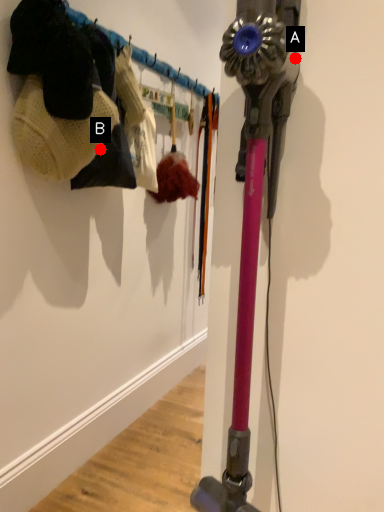
Question: Two points are circled on the image, labeled by A and B beside each circle. Which point is closer to the camera taking this photo?

Choices:
 (A) A is closer
 (B) B is closer

Answer: (A)